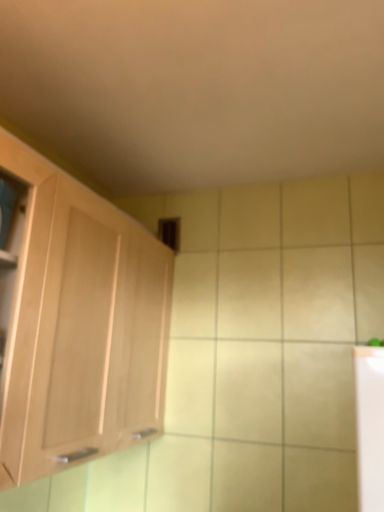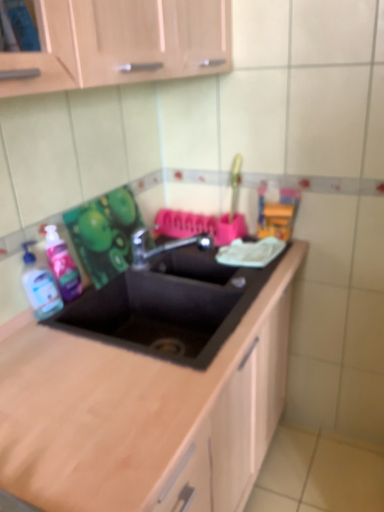
Question: How did the camera likely rotate when shooting the video?

Choices:
 (A) rotated downward
 (B) rotated upward

Answer: (A)